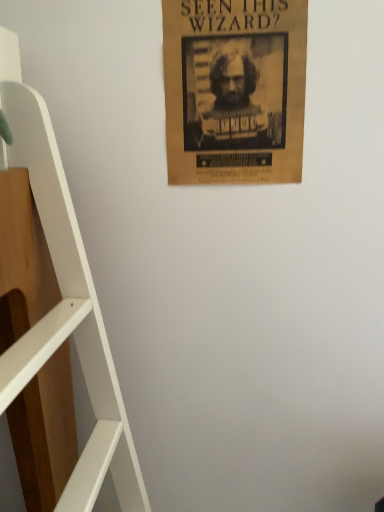
Describe the element at coordinates (234, 90) in the screenshot. I see `brown paper poster at upper center` at that location.

At what (x,y) coordinates should I click in order to perform the action: click on brown paper poster at upper center. Please return your answer as a coordinate pair (x, y). The image size is (384, 512). Looking at the image, I should click on (234, 90).

Image resolution: width=384 pixels, height=512 pixels. I want to click on brown paper poster at upper center, so click(x=234, y=90).